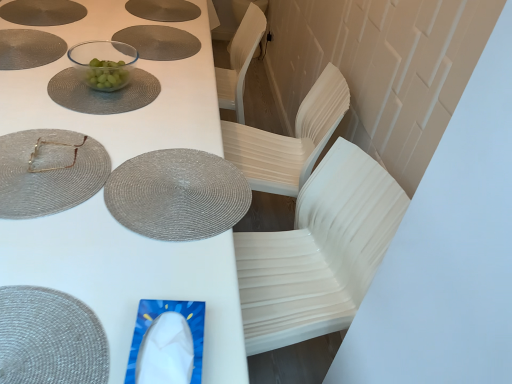
Identify the location of vacant region above matte woven placemat at upper left, which is the 2th glass plate from top to bottom (from a real-world perspective). The image size is (512, 384). (47, 158).